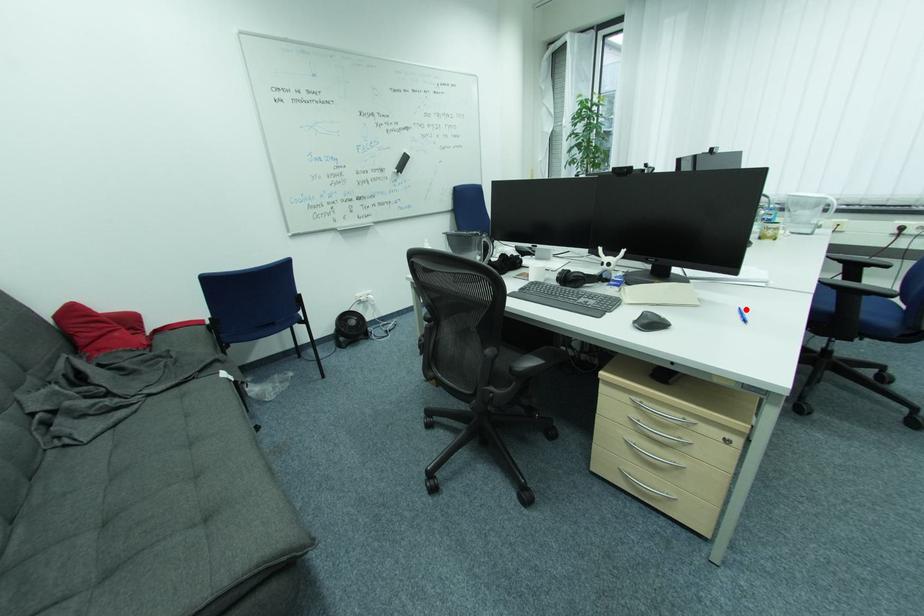
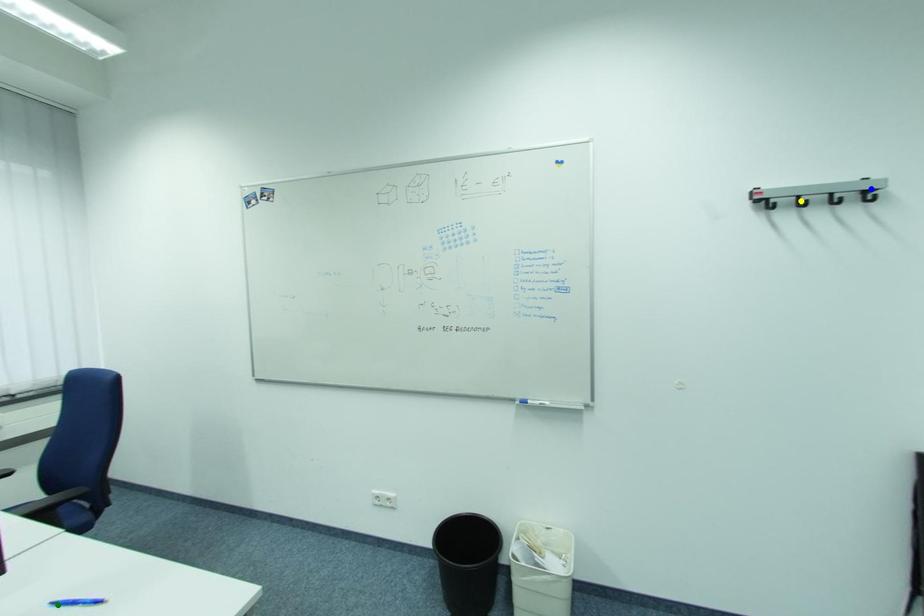
Question: I am providing you with two images of the same scene from different viewpoints. A red point is marked on the first image. You are given multiple points on the second image. Which point in image 2 is actually the same real-world point as the red point in image 1?

Choices:
 (A) blue point
 (B) green point
 (C) yellow point

Answer: (B)